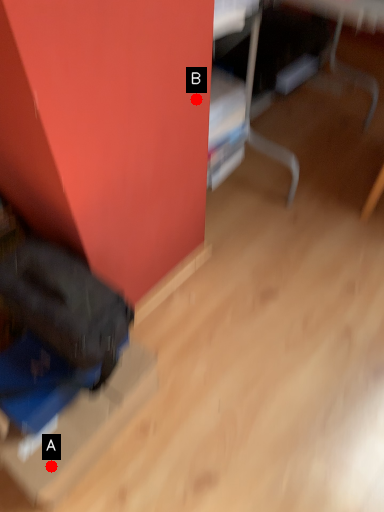
Question: Two points are circled on the image, labeled by A and B beside each circle. Which of the following is the farthest from the observer?

Choices:
 (A) A is further
 (B) B is further

Answer: (B)